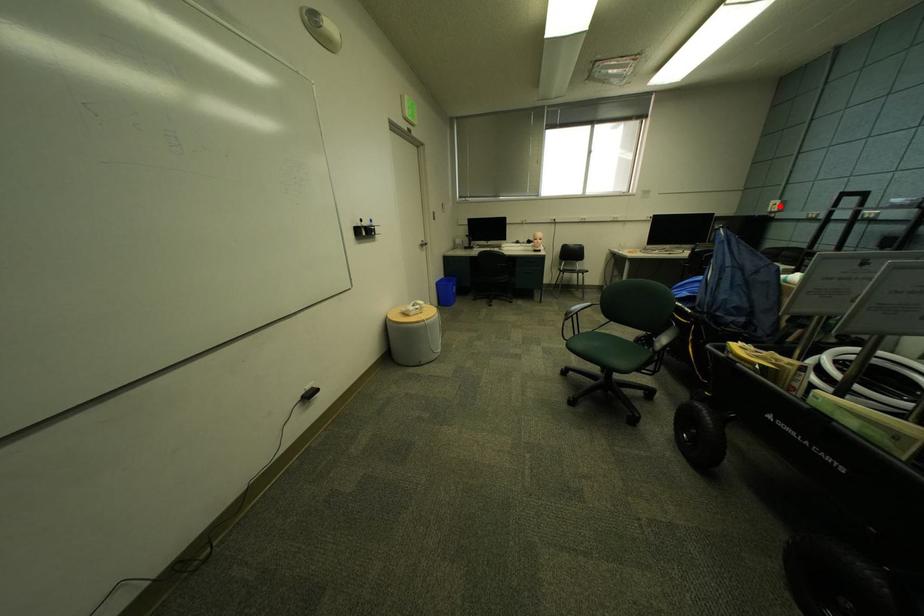
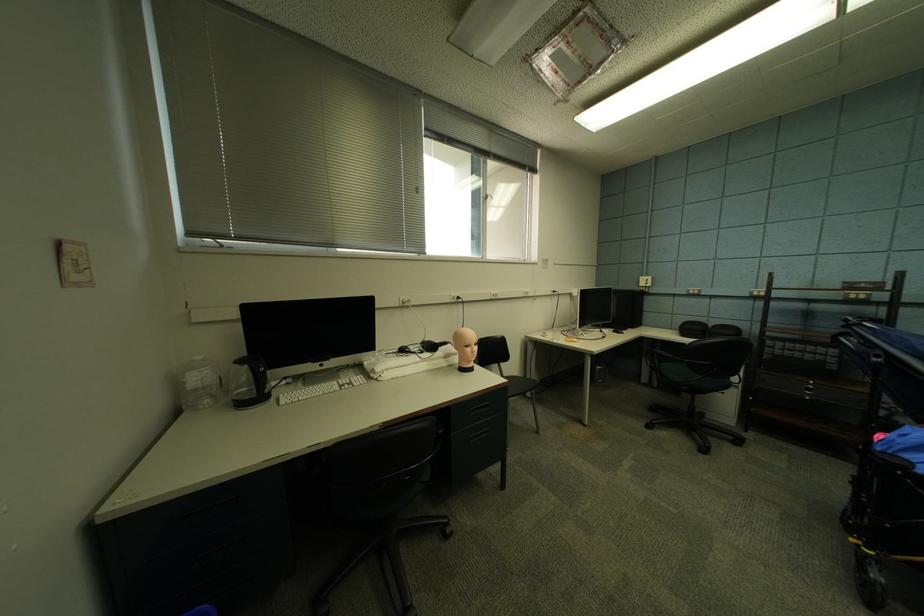
Locate, in the second image, the point that corresponds to the highlighted location in the first image.

(650, 282)